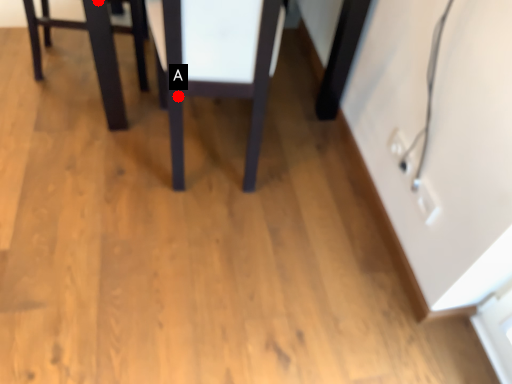
Question: Two points are circled on the image, labeled by A and B beside each circle. Among these points, which one is nearest to the camera?

Choices:
 (A) A is closer
 (B) B is closer

Answer: (A)